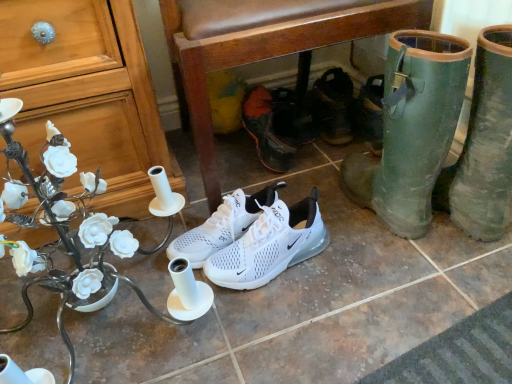
At what (x,y) coordinates should I click in order to perform the action: click on free space to the left of white mesh sneakers at center, marked as the third footwear in a back-to-front arrangement. Please return your answer as a coordinate pair (x, y). Image resolution: width=512 pixels, height=384 pixels. Looking at the image, I should click on (152, 257).